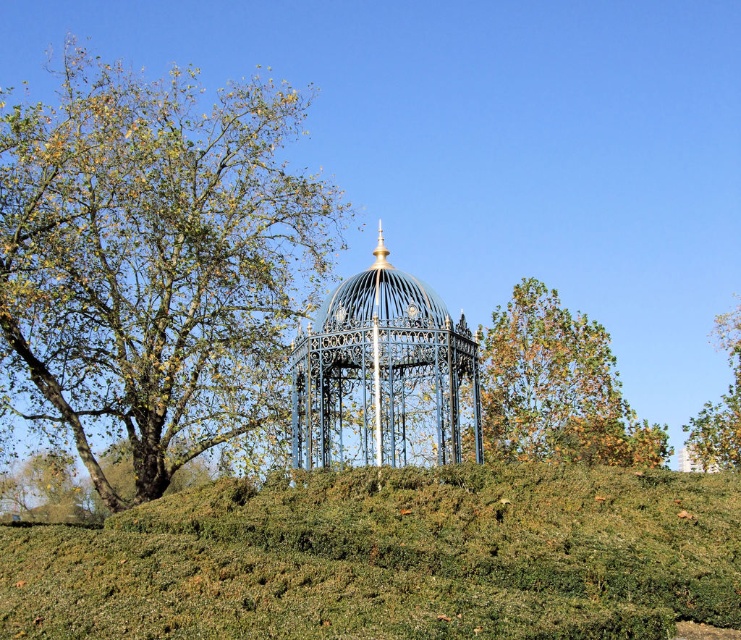
Based on the scene description, which object takes up more space in the image, the green grassy hill at center or the green leafy tree at upper right?

The green grassy hill at center is larger in size than the green leafy tree at upper right, so it takes up more space in the image.

In the scene shown: You are standing at the camera position observing the gazebo and the surrounding trees. There is a specific point marked at coordinates point (279, 374). Can you determine if you can reach that point without moving closer than 100 meters from your current position?

The distance between point (279, 374) and the camera is 100.36 meters. Since the required minimum distance is 100 meters, you can reach the point as you can stay at exactly 100.36 meters which is just beyond the 100 meter threshold.